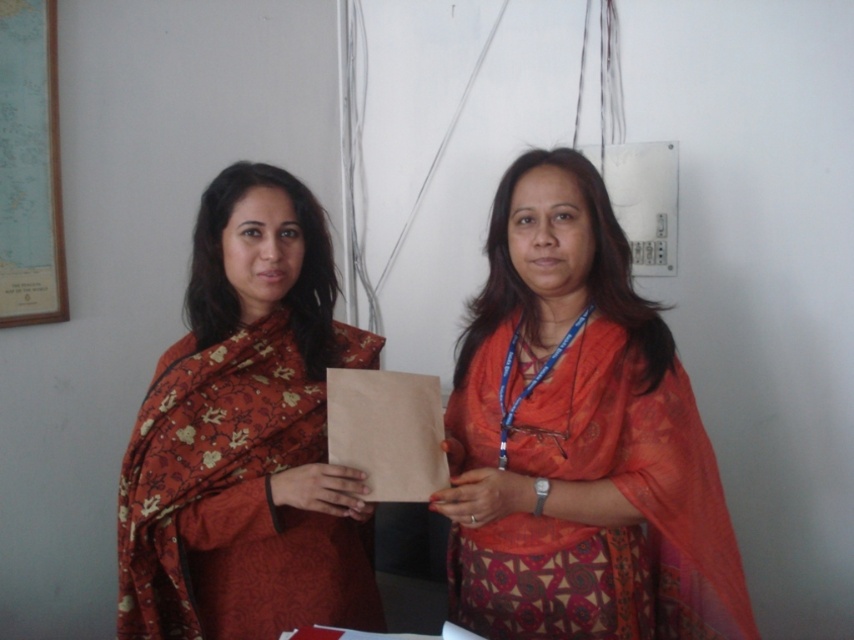
You are a photographer setting up for a photoshoot. You need to position two models wearing the matte orange sari at center and the matte floral sari at center so that the wider sari is fully visible. Which model should you place closer to the camera?

The matte orange sari at center might be wider than the matte floral sari at center, so you should place the model wearing the matte orange sari at center closer to the camera to ensure its width is fully visible.

You are a photographer setting up for a photoshoot. You need to adjust the lighting so that both the matte orange sari at center and the matte floral sari at center are equally illuminated. Given their heights, which sari should you focus the light on more to ensure proper exposure?

The matte orange sari at center has a lesser height compared to the matte floral sari at center. To ensure both are equally illuminated, focus more light on the taller matte floral sari at center since it might require more light to achieve the same exposure as the shorter one.